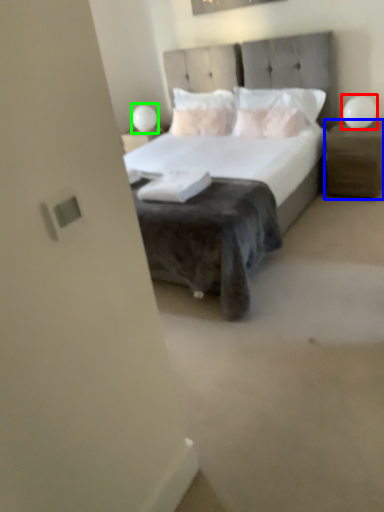
Question: Based on their relative distances, which object is nearer to table lamp (highlighted by a red box)? Choose from nightstand (highlighted by a blue box) and table lamp (highlighted by a green box).

Choices:
 (A) nightstand
 (B) table lamp

Answer: (A)